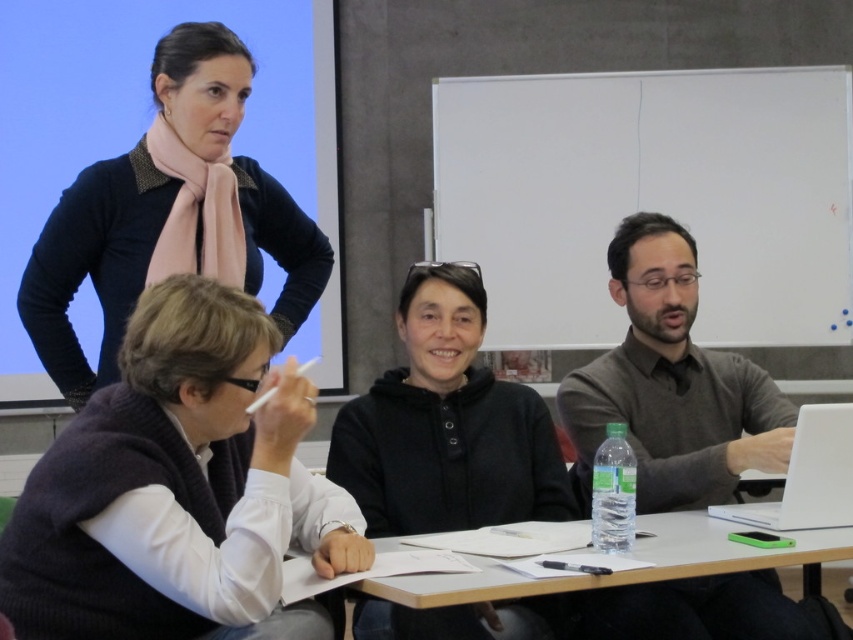
You are standing in front of the classroom scene and want to determine which of the two points is closer to you. The points are located at the coordinates point (x=196, y=92) and point (x=468, y=588). Which point is closer to your position?

Point (x=196, y=92) is closer to you because it is further to the viewer than point (x=468, y=588) according to the description.

You are standing in the classroom and need to reach the matte black sweater at upper left without moving any furniture. Can you comfortably extend your arm to touch it?

The matte black sweater at upper left is 1.93 meters away from you, so you cannot comfortably extend your arm to touch it as the distance is too far.